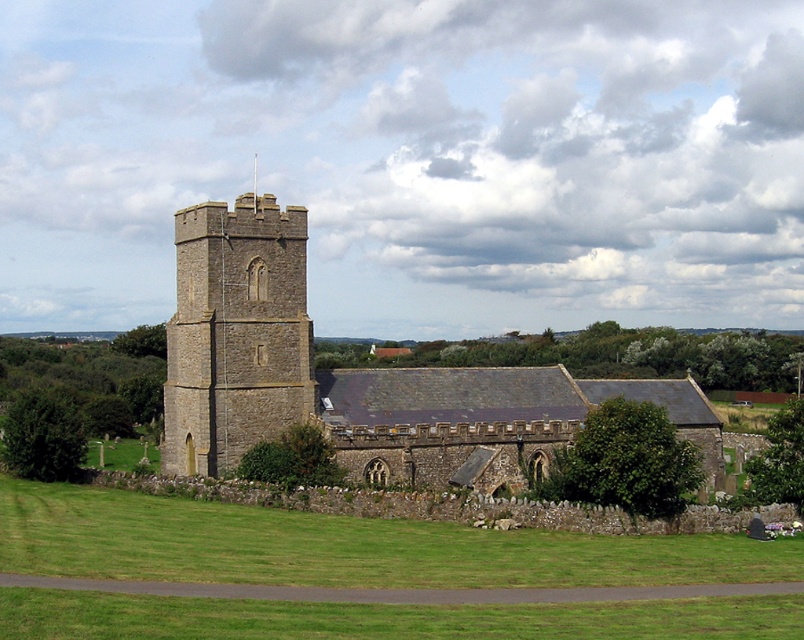
You are standing in the middle of the green grass at lower center and want to enter the brown stone church at center. Which direction should you walk to reach it?

Since the green grass at lower center is below the brown stone church at center, you should walk upwards towards the brown stone church at center to reach it.

You are standing in the rural scene facing the historic stone church. You notice two points marked on the ground. The first point is at coordinate point (x=165, y=625) and the second is at point (x=507, y=387). If you want to walk towards the church, which point should you step on first?

You should step on point (x=165, y=625) first because it is in front of point (x=507, y=387), meaning it is closer to the church when facing it.

You are standing in the rural scene and want to walk towards the stone tower at center. Which direction should you move relative to the green grass at lower center?

Since the green grass at lower center is closer to the viewer than the stone tower at center, you should move away from the green grass at lower center to reach the stone tower at center.